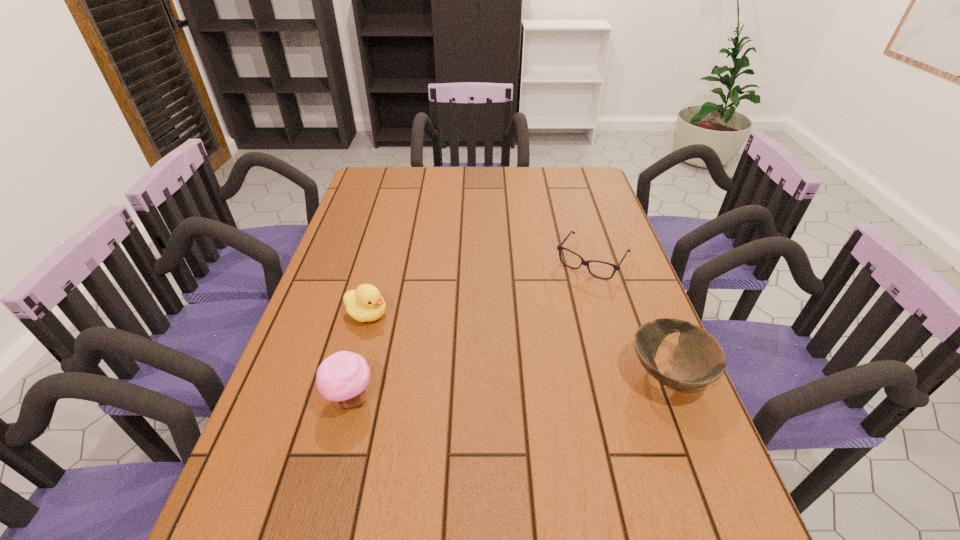
The image size is (960, 540). Identify the location of free space located 0.140m on the beak of the second farthest object. pyautogui.click(x=430, y=340).

This screenshot has height=540, width=960. What are the coordinates of `vacant space positioned on the beak of the second farthest object` in the screenshot? It's located at (490, 366).

The height and width of the screenshot is (540, 960). Find the location of `free region located 0.070m on the beak of the second farthest object`. free region located 0.070m on the beak of the second farthest object is located at coordinates (407, 330).

This screenshot has height=540, width=960. In order to click on cupcake that is at the left edge in this screenshot , I will do `click(342, 378)`.

I want to click on duckling at the left edge, so click(365, 304).

Locate an element on the screen. The height and width of the screenshot is (540, 960). bowl that is at the right edge is located at coordinates (699, 360).

Identify the location of spectacles located at the right edge. The image size is (960, 540). (586, 263).

This screenshot has height=540, width=960. Identify the location of vacant space at the far edge of the desktop. coord(450,197).

Locate an element on the screen. The width and height of the screenshot is (960, 540). free space at the near edge of the desktop is located at coordinates (555, 488).

Identify the location of free spot at the left edge of the desktop. The height and width of the screenshot is (540, 960). (369, 267).